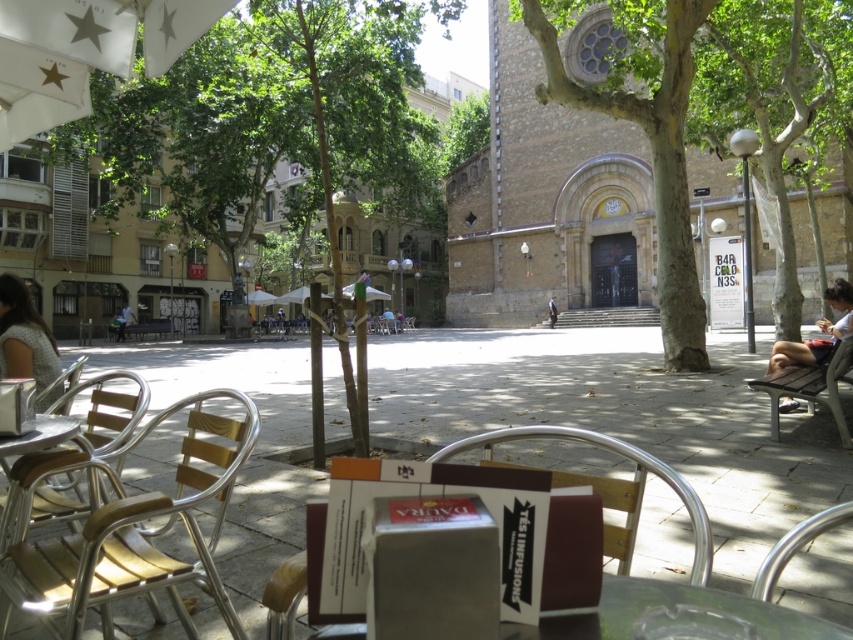
Is wooden chair at center thinner than light brown wooden chair at center?

No.

Which is behind, point (631, 486) or point (131, 314)?

Positioned behind is point (131, 314).

You are a GUI agent. You are given a task and a screenshot of the screen. Output one action in this format:
    pyautogui.click(x=<x>, y=<y>)
    Task: Click on the wooden chair at center
    
    Given the screenshot: What is the action you would take?
    pyautogui.click(x=608, y=488)

Can you confirm if green leafy tree at center is wider than gray fabric dress at lower left?

Yes.

Is green leafy tree at center closer to camera compared to gray fabric dress at lower left?

No, it is not.

Does point (378, 161) come closer to viewer compared to point (10, 340)?

No, (378, 161) is behind (10, 340).

At what (x,y) coordinates should I click in order to perform the action: click on green leafy tree at center. Please return your answer as a coordinate pair (x, y). Image resolution: width=853 pixels, height=640 pixels. Looking at the image, I should click on (355, 125).

Is light blue denim shorts at right further to camera compared to metallic silver chair at lower right?

Yes, light blue denim shorts at right is further from the viewer.

In the scene shown: Who is positioned more to the right, light blue denim shorts at right or metallic silver chair at lower right?

light blue denim shorts at right is more to the right.

Who is more forward, (776, 358) or (795, 552)?

Positioned in front is point (795, 552).

You are a GUI agent. You are given a task and a screenshot of the screen. Output one action in this format:
    pyautogui.click(x=<x>, y=<y>)
    Task: Click on the light blue denim shorts at right
    Image resolution: width=853 pixels, height=640 pixels.
    Given the screenshot: What is the action you would take?
    pyautogui.click(x=820, y=330)